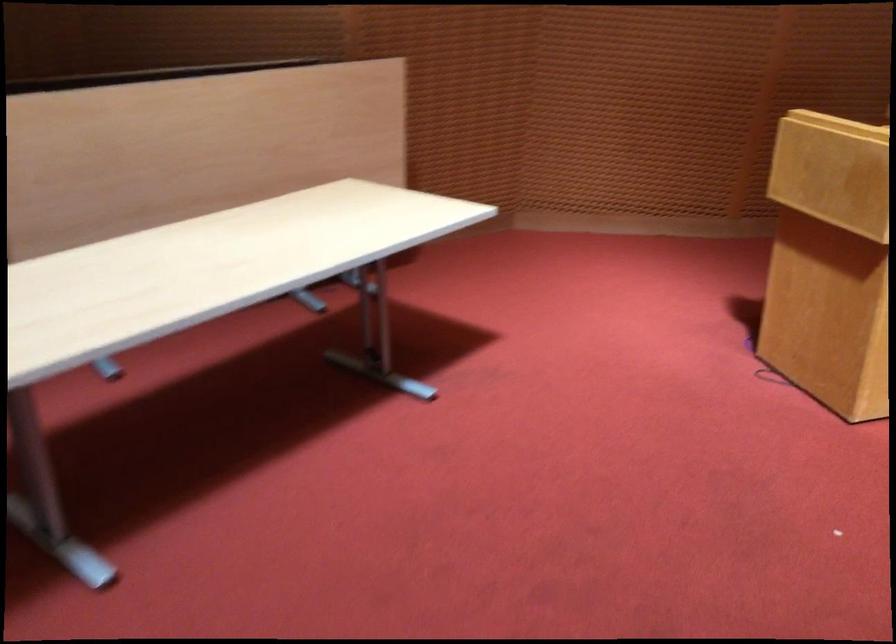
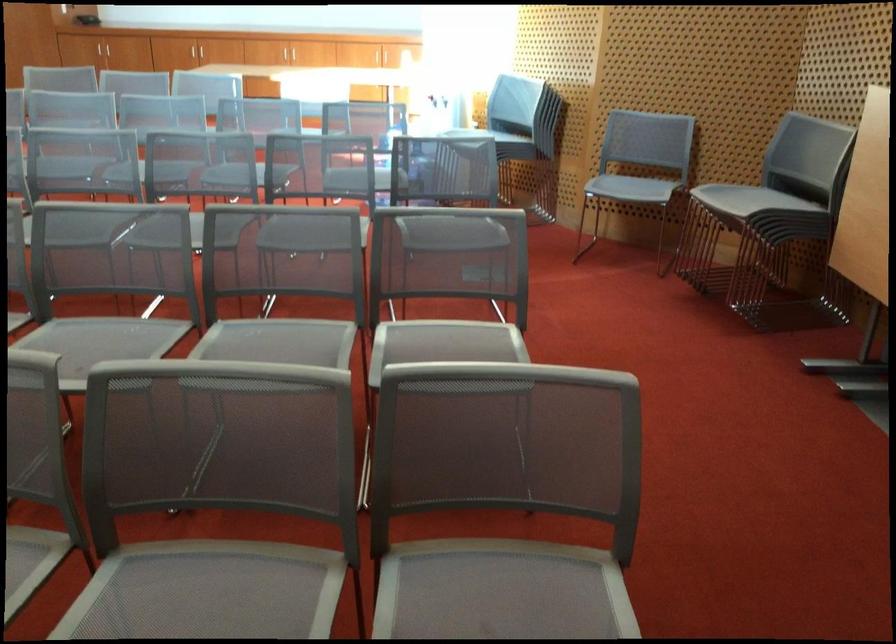
Question: Which direction would the cameraman need to move to produce the second image? Reply with the corresponding letter.

Choices:
 (A) Left
 (B) Right
 (C) Forward
 (D) Backward

Answer: (D)